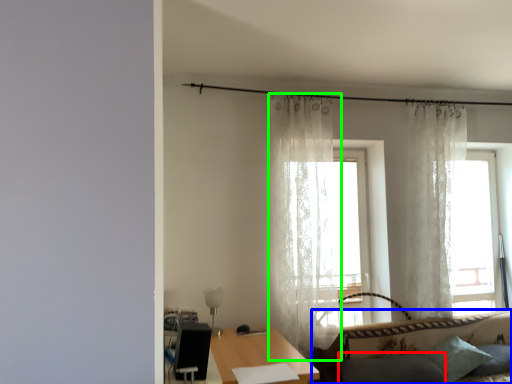
Question: Based on their relative distances, which object is farther from pillow (highlighted by a red box)? Choose from studio couch (highlighted by a blue box) and curtain (highlighted by a green box).

Choices:
 (A) studio couch
 (B) curtain

Answer: (B)